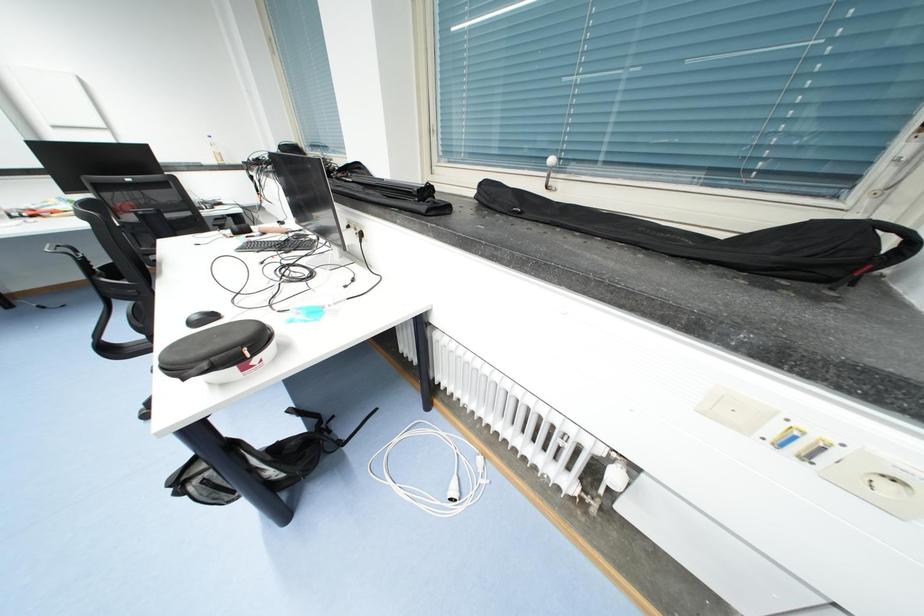
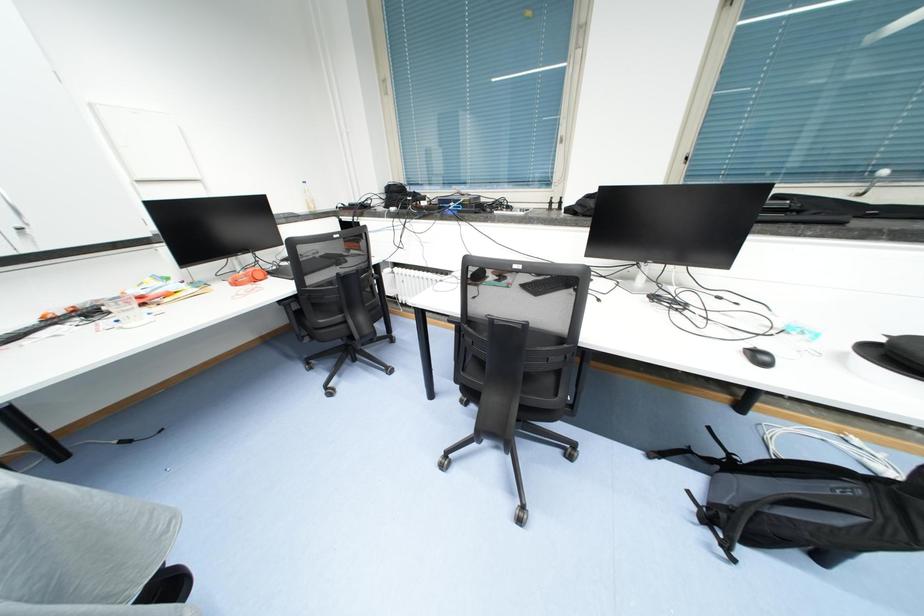
Question: The images are taken continuously from a first-person perspective. In which direction are you moving?

Choices:
 (A) Left
 (B) Right
 (C) Forward
 (D) Backward

Answer: (A)